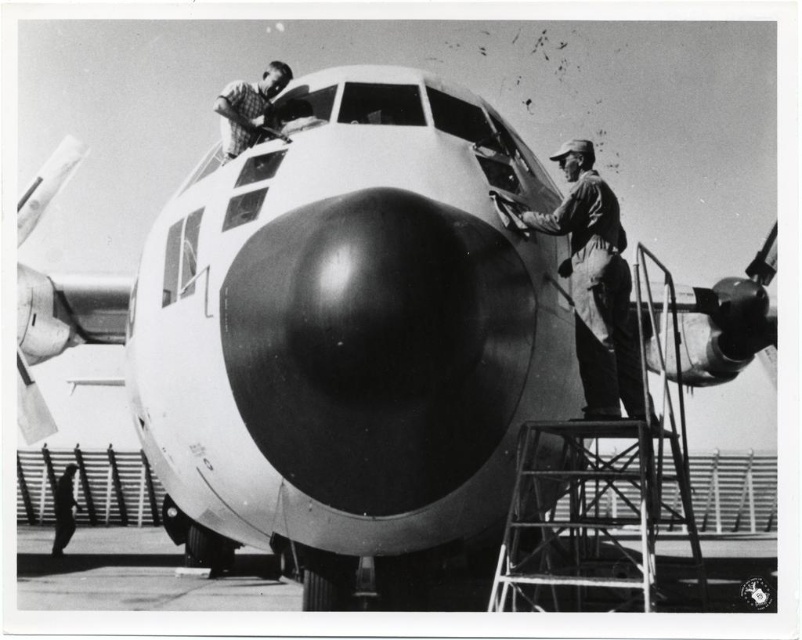
Question: Which object appears closest to the camera in this image?

Choices:
 (A) brushed metal airplane at upper center
 (B) dark gray uniform at lower left
 (C) dark gray uniform at center

Answer: (C)

Question: Is brushed metal airplane at upper center further to camera compared to dark gray uniform at lower left?

Choices:
 (A) yes
 (B) no

Answer: (B)

Question: Which point appears farthest from the camera in this image?

Choices:
 (A) (59, 545)
 (B) (525, 216)

Answer: (A)

Question: Does dark gray uniform at center lie in front of brushed metal airplane at upper center?

Choices:
 (A) yes
 (B) no

Answer: (A)

Question: Does dark gray uniform at center have a lesser width compared to brushed metal airplane at upper center?

Choices:
 (A) yes
 (B) no

Answer: (B)

Question: Which of the following is the farthest from the observer?

Choices:
 (A) (256, 102)
 (B) (592, 412)
 (C) (61, 486)

Answer: (C)